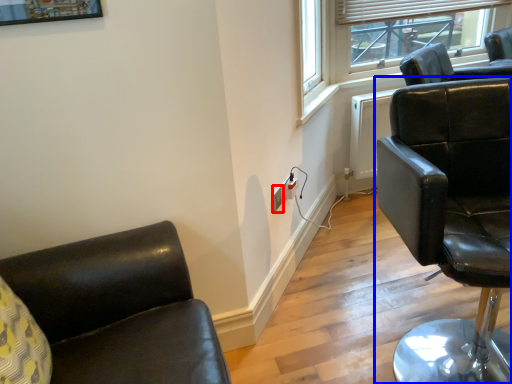
Question: Which of the following is the closest to the observer, electric outlet (highlighted by a red box) or chair (highlighted by a blue box)?

Choices:
 (A) electric outlet
 (B) chair

Answer: (B)